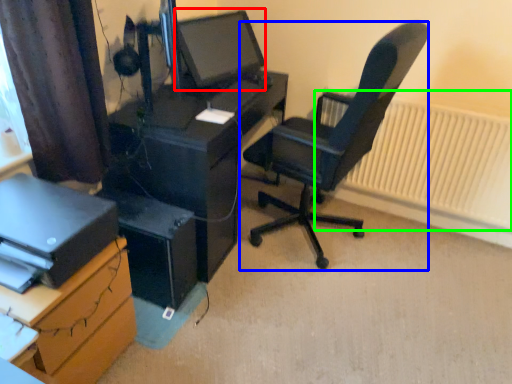
Question: Which object is the closest to the computer monitor (highlighted by a red box)? Choose among these: chair (highlighted by a blue box) or radiator (highlighted by a green box).

Choices:
 (A) chair
 (B) radiator

Answer: (A)